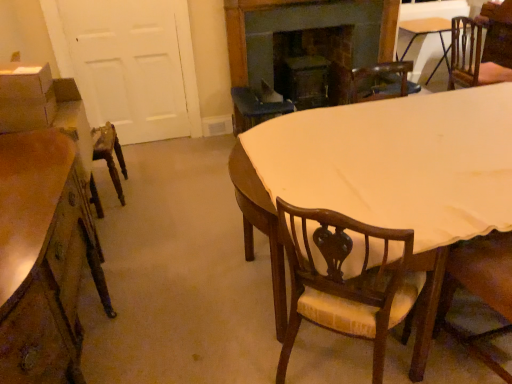
Question: Is point (478, 66) closer or farther from the camera than point (142, 0)?

Choices:
 (A) closer
 (B) farther

Answer: (B)

Question: Considering the positions of brown wood chair at upper right, which is the third chair from left to right, and white matte door at left in the image, is brown wood chair at upper right, which is the third chair from left to right, wider or thinner than white matte door at left?

Choices:
 (A) thin
 (B) wide

Answer: (B)

Question: Which object is the farthest from the dark wood fireplace at upper center?

Choices:
 (A) wooden chair with upholstered seat at center, which is counted as the 1th chair, starting from the bottom
 (B) light brown wooden table at center
 (C) wooden chair with cushion at lower right, placed as the first chair when sorted from front to back
 (D) wooden table at upper right
 (E) wooden desk at left

Answer: (A)

Question: Which object is positioned closest to the dark wood fireplace at upper center?

Choices:
 (A) wooden table at upper right
 (B) wooden chair with upholstered seat at center, marked as the 3th chair in a right-to-left arrangement
 (C) light brown wooden table at center
 (D) wooden chair with cushion at lower right, the second chair positioned from the left
 (E) white matte door at left

Answer: (A)